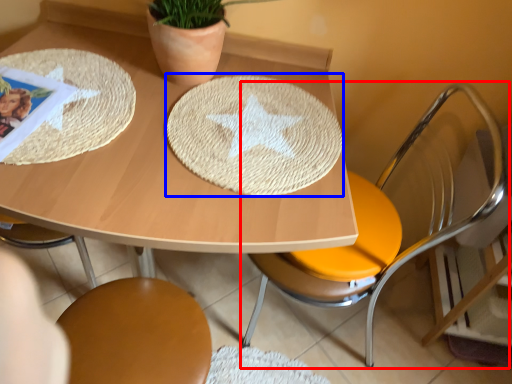
Question: Which object is closer to the camera taking this photo, chair (highlighted by a red box) or plate (highlighted by a blue box)?

Choices:
 (A) chair
 (B) plate

Answer: (A)